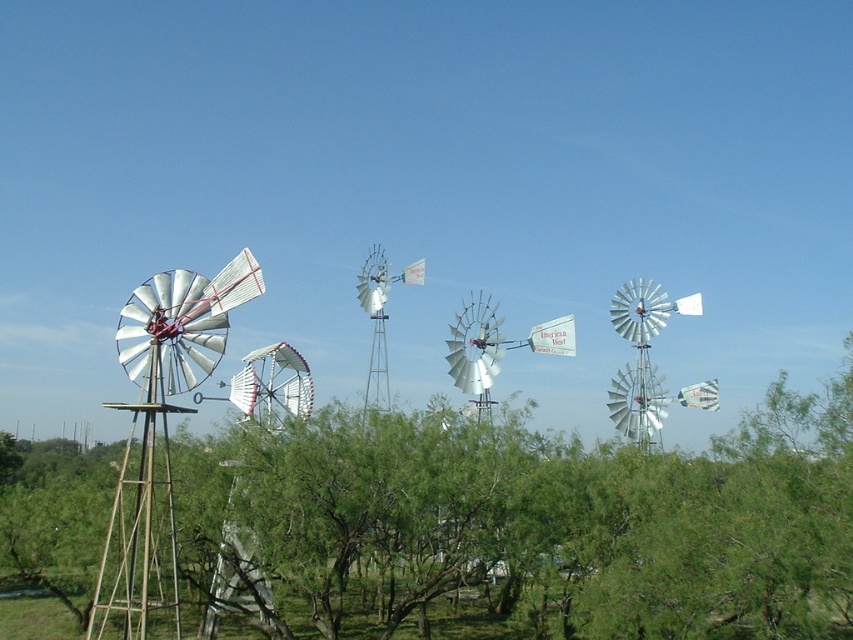
You are standing at the center of the field and want to take a photo of the silver metallic windmill at left without the green leafy tree at left blocking it. How should you adjust your position?

Move to the right side of the green leafy tree at left so that the silver metallic windmill at left becomes visible behind it, as the green leafy tree at left is currently in front of the silver metallic windmill at left.

You are standing at the center of the field and want to walk towards the silver metallic windmill at left. There is a green leafy tree at left blocking your path. Can you walk around it? Please explain your reasoning based on the distance between them.

The green leafy tree at left is 7.88 meters away from the silver metallic windmill at left. Since the tree is blocking the path, you can walk around it because there is enough space between the tree and the windmill to maneuver around the obstruction without being too close.